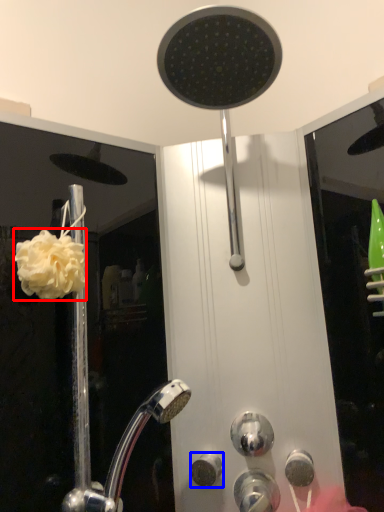
Question: Which object appears farthest to the camera in this image, flower (highlighted by a red box) or knob (highlighted by a blue box)?

Choices:
 (A) flower
 (B) knob

Answer: (B)